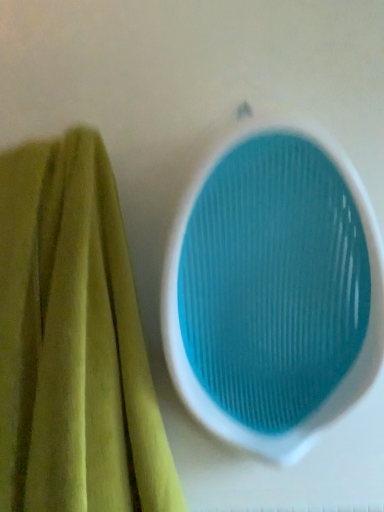
Question: From the image's perspective, is blue textured bowl at center over green velvety towel at left?

Choices:
 (A) no
 (B) yes

Answer: (B)

Question: Considering the relative positions of blue textured bowl at center and green velvety towel at left in the image provided, is blue textured bowl at center to the left of green velvety towel at left from the viewer's perspective?

Choices:
 (A) yes
 (B) no

Answer: (B)

Question: Is blue textured bowl at center facing towards green velvety towel at left?

Choices:
 (A) no
 (B) yes

Answer: (A)

Question: Would you say blue textured bowl at center contains green velvety towel at left?

Choices:
 (A) no
 (B) yes

Answer: (A)

Question: Is blue textured bowl at center next to green velvety towel at left?

Choices:
 (A) yes
 (B) no

Answer: (B)

Question: Considering the relative positions of blue textured bowl at center and green velvety towel at left in the image provided, is blue textured bowl at center behind green velvety towel at left?

Choices:
 (A) yes
 (B) no

Answer: (A)

Question: Is green velvety towel at left bigger than blue textured bowl at center?

Choices:
 (A) no
 (B) yes

Answer: (B)

Question: Considering the relative sizes of green velvety towel at left and blue textured bowl at center in the image provided, is green velvety towel at left wider than blue textured bowl at center?

Choices:
 (A) no
 (B) yes

Answer: (B)

Question: Is green velvety towel at left positioned behind blue textured bowl at center?

Choices:
 (A) no
 (B) yes

Answer: (A)

Question: Can you confirm if green velvety towel at left is shorter than blue textured bowl at center?

Choices:
 (A) yes
 (B) no

Answer: (B)

Question: Would you say blue textured bowl at center is part of green velvety towel at left's contents?

Choices:
 (A) no
 (B) yes

Answer: (A)

Question: Is green velvety towel at left to the left of blue textured bowl at center from the viewer's perspective?

Choices:
 (A) yes
 (B) no

Answer: (A)

Question: Visually, is blue textured bowl at center positioned to the left or to the right of green velvety towel at left?

Choices:
 (A) right
 (B) left

Answer: (A)